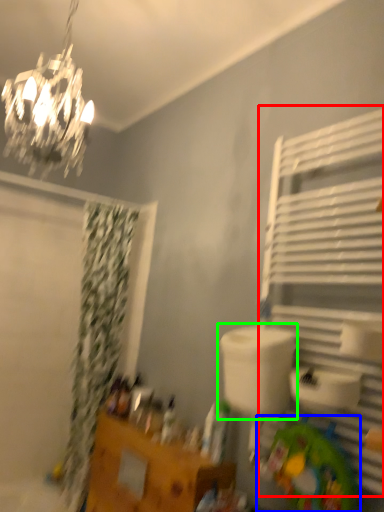
Question: Based on their relative distances, which object is nearer to shelf (highlighted by a red box)? Choose from toy (highlighted by a blue box) and sink (highlighted by a green box).

Choices:
 (A) toy
 (B) sink

Answer: (B)